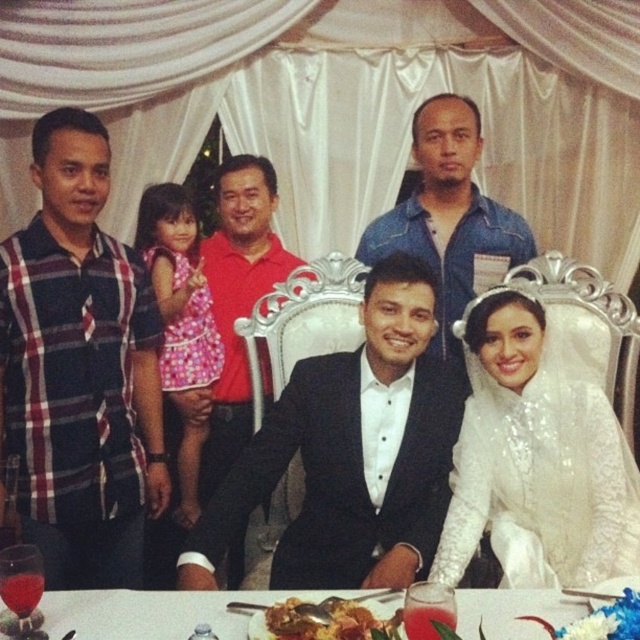
Between white sequined dress at center and denim shirt at center, which one appears on the left side from the viewer's perspective?

From the viewer's perspective, denim shirt at center appears more on the left side.

Between white sequined dress at center and denim shirt at center, which one has less height?

white sequined dress at center is shorter.

Which is behind, point (573, 506) or point (454, 141)?

Point (454, 141)

At what (x,y) coordinates should I click in order to perform the action: click on white sequined dress at center. Please return your answer as a coordinate pair (x, y). The image size is (640, 640). Looking at the image, I should click on (536, 458).

Consider the image. Can you confirm if white sequined dress at center is positioned to the right of translucent glass water at lower center?

Yes, white sequined dress at center is to the right of translucent glass water at lower center.

Between white sequined dress at center and translucent glass water at lower center, which one is positioned lower?

Positioned lower is translucent glass water at lower center.

Does point (612, 426) come in front of point (230, 636)?

No.

Find the location of `white sequined dress at center`. white sequined dress at center is located at coordinates (536, 458).

Is black satin suit at center bigger than red smooth shirt at center?

Yes, black satin suit at center is bigger than red smooth shirt at center.

Measure the distance between black satin suit at center and camera.

black satin suit at center and camera are 1.64 meters apart from each other.

Locate an element on the screen. black satin suit at center is located at coordinates (352, 452).